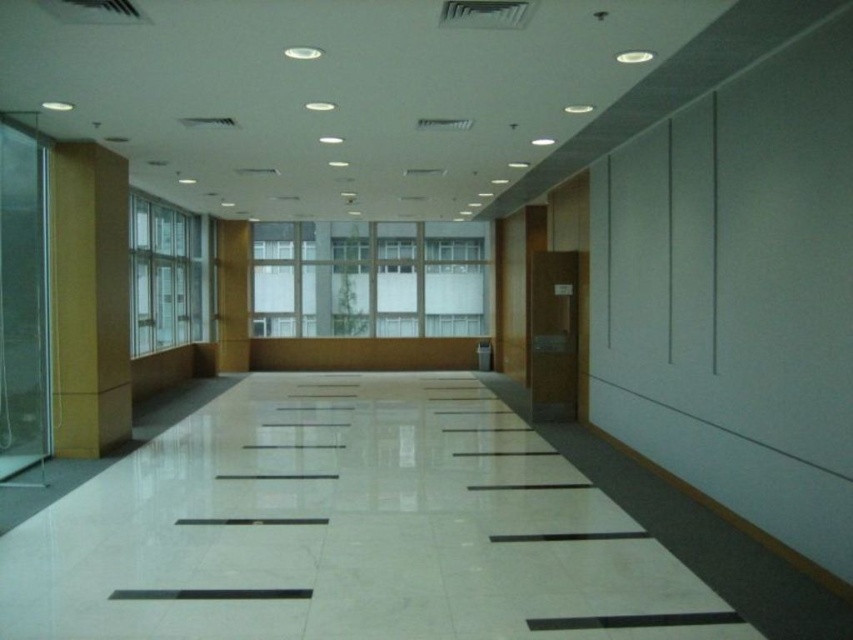
Question: Estimate the real-world distances between objects in this image. Which object is closer to the clear glass window at center?

Choices:
 (A) matte yellow wall at left
 (B) clear glass window at left

Answer: (B)

Question: Which object appears closest to the camera in this image?

Choices:
 (A) matte yellow wall at left
 (B) clear glass window at left

Answer: (A)

Question: Is clear glass window at center above matte yellow wall at left?

Choices:
 (A) no
 (B) yes

Answer: (B)

Question: From the image, what is the correct spatial relationship of matte yellow wall at left in relation to clear glass window at left?

Choices:
 (A) left
 (B) right

Answer: (B)

Question: Among these points, which one is farthest from the camera?

Choices:
 (A) (316, 305)
 (B) (57, 225)
 (C) (160, 244)

Answer: (A)

Question: Can you confirm if matte yellow wall at left is positioned below clear glass window at left?

Choices:
 (A) no
 (B) yes

Answer: (B)